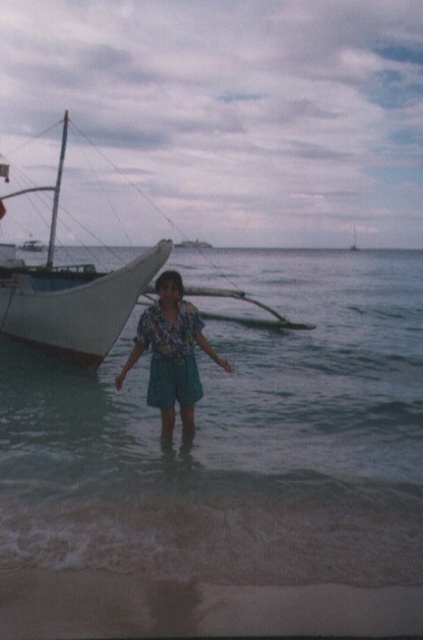
Based on the photo, does clear water at center have a larger size compared to floral fabric shirt at center?

Yes.

Between clear water at center and floral fabric shirt at center, which one has more height?

clear water at center is taller.

Locate an element on the screen. This screenshot has height=640, width=423. clear water at center is located at coordinates (228, 470).

At what (x,y) coordinates should I click in order to perform the action: click on clear water at center. Please return your answer as a coordinate pair (x, y). Looking at the image, I should click on pos(228,470).

Is point (79, 291) positioned before point (197, 378)?

No, (79, 291) is behind (197, 378).

Is white matte boat at left positioned at the back of floral fabric shirt at center?

Yes.

Measure the distance between point (0, 273) and camera.

15.65 meters

The height and width of the screenshot is (640, 423). Identify the location of white matte boat at left. pos(71,291).

Measure the distance between point (412, 518) and camera.

Point (412, 518) and camera are 6.28 meters apart from each other.

Does clear water at center have a greater width compared to white matte boat at left?

No, clear water at center is not wider than white matte boat at left.

I want to click on clear water at center, so click(228, 470).